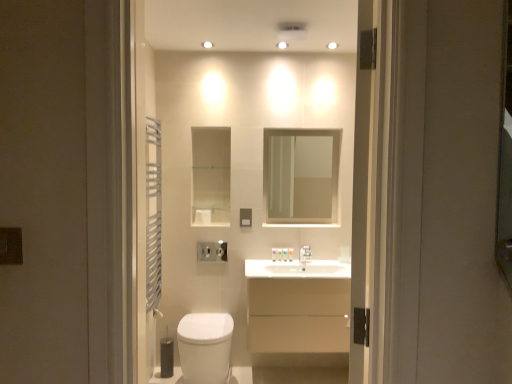
Locate an element on the screen. The width and height of the screenshot is (512, 384). blank area to the left of white matte toilet paper at right, which is counted as the 2th toilet paper, starting from the top is located at coordinates pyautogui.click(x=324, y=262).